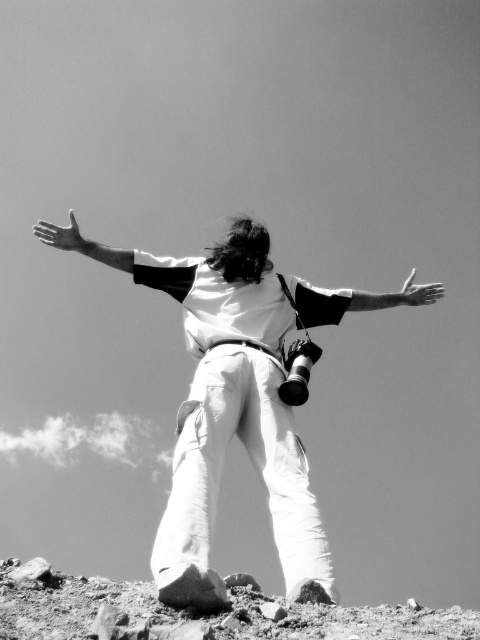
You are a photographer analyzing the composition of this image. You notice the smooth white arm at center and the matte white hand at upper left. Which object takes up more space in the photo?

The matte white hand at upper left occupies more space in the photo than the smooth white arm at center.

You are a drone operator trying to capture a photo of the person standing on the rocky surface. The camera is slung over their shoulder. You need to position your drone so that it stays exactly 100 feet away from the camera. Is the point at coordinates point [365,308] within the required distance?

The point at point [365,308] is 136.93 feet away from the camera, which is farther than the required 100 feet. Therefore, the drone cannot be positioned at point [365,308] to stay within the 100 feet distance requirement.

You are a photographer trying to capture the scene of a person standing on a rocky hilltop. You notice the white cotton pants at center and the smooth white arm at center. Which object in the image is wider?

The white cotton pants at center is wider than the smooth white arm at center.